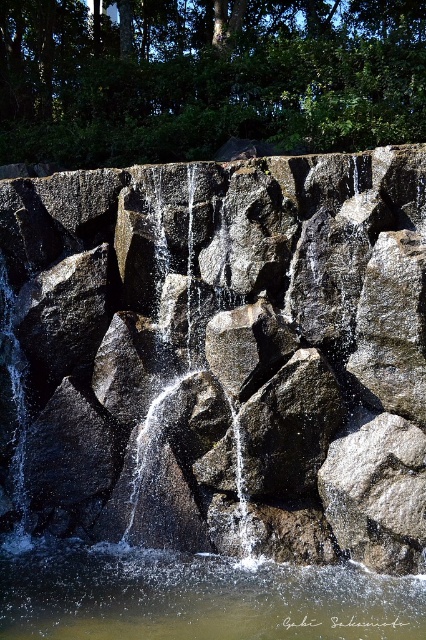
Question: Which point is closer to the camera?

Choices:
 (A) (267, 579)
 (B) (230, 262)

Answer: (A)

Question: Which point is closer to the camera?

Choices:
 (A) clear water at center
 (B) dark gray rock at center

Answer: (A)

Question: Is dark gray rock at center below clear water at center?

Choices:
 (A) yes
 (B) no

Answer: (B)

Question: Can you confirm if dark gray rock at center is positioned to the right of clear water at center?

Choices:
 (A) no
 (B) yes

Answer: (B)

Question: Is dark gray rock at center wider than clear water at center?

Choices:
 (A) yes
 (B) no

Answer: (A)

Question: Among these points, which one is nearest to the camera?

Choices:
 (A) (215, 291)
 (B) (273, 621)

Answer: (B)